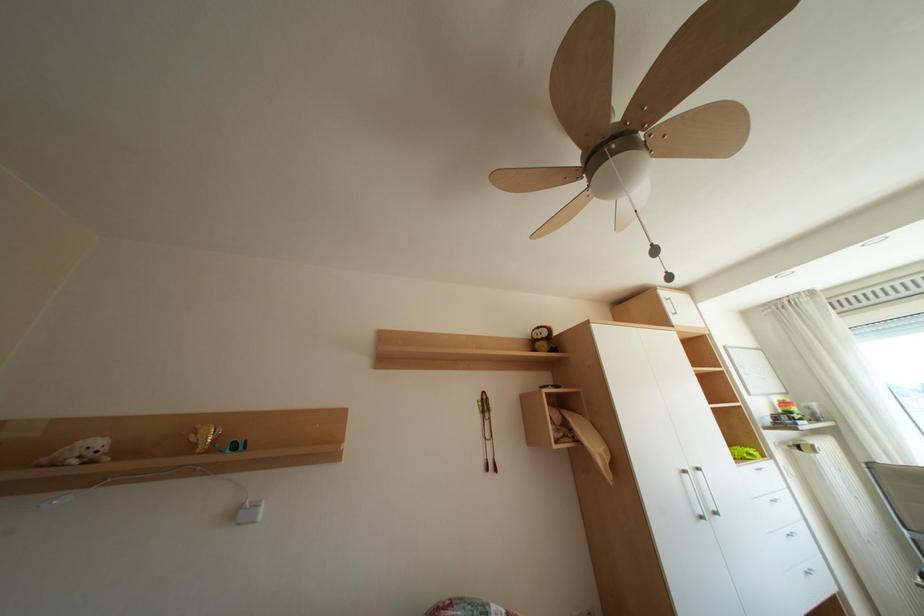
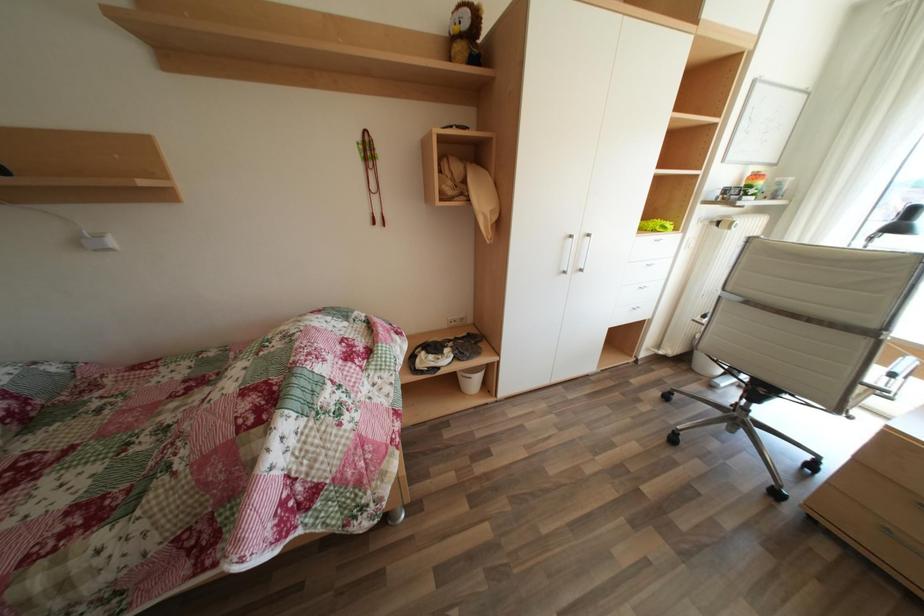
Question: How did the camera likely rotate?

Choices:
 (A) Left
 (B) Right
 (C) Up
 (D) Down

Answer: (D)